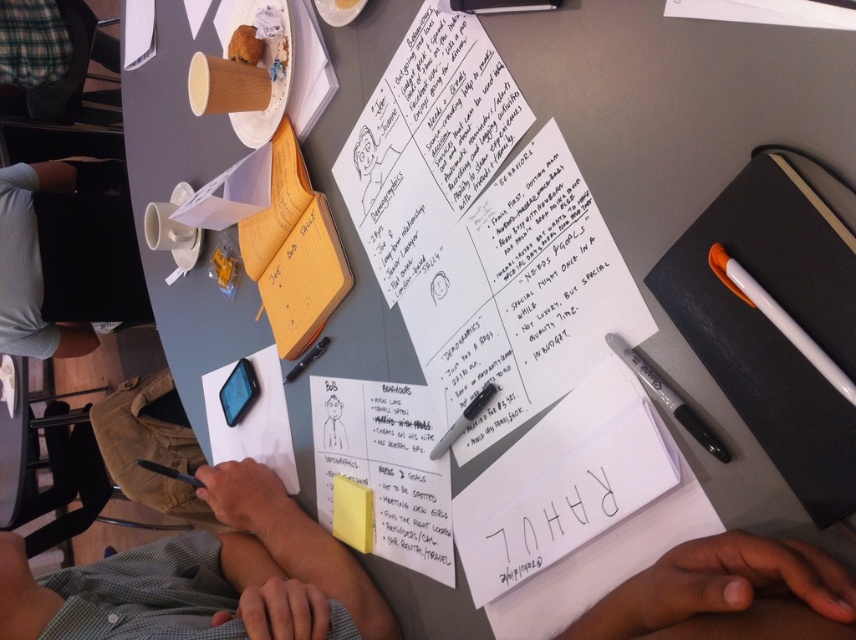
Where is the black fabric shirt at left located in the image?

The black fabric shirt at left is located at point 0.406 on the x axis and 0.075 on the y axis.

You are a person trying to reach the black plastic pen at upper right from your current position near the black fabric shirt at left. Can you comfortably reach it without moving your torso?

The distance between the black fabric shirt at left and the black plastic pen at upper right is 5.32 feet. Since this distance is greater than the typical comfortable reaching distance of around 2 feet, you would need to move your torso or get closer to reach the pen.

You are organizing the workspace and need to place both the white paper at center and the yellow sticky note at center into a folder. Which one should you place first if you want to ensure the smaller item fits without overlapping?

You should place the yellow sticky note at center first because it is smaller than the white paper at center, allowing it to fit without overlapping.